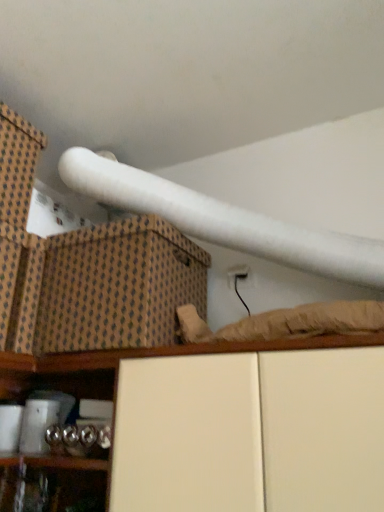
What do you see at coordinates (17, 165) in the screenshot? I see `brown woven box at upper left` at bounding box center [17, 165].

Identify the location of brown textured cardboard box at upper left. The width and height of the screenshot is (384, 512). (118, 286).

Is white matte cabinet at lower center not inside brown woven box at upper left?

white matte cabinet at lower center is positioned outside brown woven box at upper left.

Is there a large distance between white matte cabinet at lower center and brown woven box at upper left?

white matte cabinet at lower center is near brown woven box at upper left, not far away.

From a real-world perspective, is white matte cabinet at lower center above or below brown woven box at upper left?

white matte cabinet at lower center is below brown woven box at upper left.

Is white matte cabinet at lower center at the left side of brown woven box at upper left?

No.

From the image's perspective, does brown woven box at upper left appear higher than brown textured cardboard box at upper left?

Yes, from the image's perspective, brown woven box at upper left is above brown textured cardboard box at upper left.

Is brown woven box at upper left surrounding brown textured cardboard box at upper left?

No, brown textured cardboard box at upper left is not inside brown woven box at upper left.

Which of these two, brown woven box at upper left or brown textured cardboard box at upper left, stands taller?

brown textured cardboard box at upper left is taller.

Which of these two, brown textured cardboard box at upper left or white matte cabinet at lower center, is thinner?

white matte cabinet at lower center.

Image resolution: width=384 pixels, height=512 pixels. In order to click on shelf in front of the brown textured cardboard box at upper left in this screenshot , I will do `click(240, 426)`.

Considering the relative sizes of brown textured cardboard box at upper left and white matte cabinet at lower center in the image provided, is brown textured cardboard box at upper left bigger than white matte cabinet at lower center?

No, brown textured cardboard box at upper left is not bigger than white matte cabinet at lower center.

From the image's perspective, who appears lower, white matte cabinet at lower center or brown textured cardboard box at upper left?

white matte cabinet at lower center.

Is white matte cabinet at lower center wider or thinner than brown textured cardboard box at upper left?

Clearly, white matte cabinet at lower center has less width compared to brown textured cardboard box at upper left.

Does point (357, 371) appear closer or farther from the camera than point (86, 239)?

Clearly, point (357, 371) is closer to the camera than point (86, 239).

How far apart are white matte cabinet at lower center and brown textured cardboard box at upper left?

8.99 inches.

Between brown textured cardboard box at upper left and brown woven box at upper left, which one has smaller width?

brown woven box at upper left.

Where is `box behind the brown textured cardboard box at upper left`? box behind the brown textured cardboard box at upper left is located at coordinates (17, 165).

Considering the positions of points (152, 262) and (8, 150), is point (152, 262) farther from camera compared to point (8, 150)?

No, (152, 262) is closer to viewer.

Who is bigger, brown textured cardboard box at upper left or brown woven box at upper left?

brown textured cardboard box at upper left is bigger.

Can you confirm if brown woven box at upper left is shorter than white matte cabinet at lower center?

Yes.

From a real-world perspective, does brown woven box at upper left stand above white matte cabinet at lower center?

Yes, from a real-world perspective, brown woven box at upper left is on top of white matte cabinet at lower center.

Considering their positions, is brown woven box at upper left located in front of or behind white matte cabinet at lower center?

Visually, brown woven box at upper left is located behind white matte cabinet at lower center.

Between brown woven box at upper left and white matte cabinet at lower center, which one appears on the left side from the viewer's perspective?

brown woven box at upper left.

Locate an element on the screen. Image resolution: width=384 pixels, height=512 pixels. box above the white matte cabinet at lower center (from a real-world perspective) is located at coordinates (17, 165).

This screenshot has width=384, height=512. I want to click on cardboard box on the right of the brown woven box at upper left, so click(x=118, y=286).

Based on their spatial positions, is brown woven box at upper left or brown textured cardboard box at upper left further from white matte cabinet at lower center?

brown woven box at upper left.

From the image, which object appears to be nearer to brown woven box at upper left, brown textured cardboard box at upper left or white matte cabinet at lower center?

Among the two, brown textured cardboard box at upper left is located nearer to brown woven box at upper left.

Which object lies further to the anchor point brown woven box at upper left, white matte cabinet at lower center or brown textured cardboard box at upper left?

Among the two, white matte cabinet at lower center is located further to brown woven box at upper left.

Estimate the real-world distances between objects in this image. Which object is further from brown textured cardboard box at upper left, white matte cabinet at lower center or brown woven box at upper left?

The object further to brown textured cardboard box at upper left is brown woven box at upper left.

Which object lies nearer to the anchor point white matte cabinet at lower center, brown textured cardboard box at upper left or brown woven box at upper left?

brown textured cardboard box at upper left is closer to white matte cabinet at lower center.

Which object lies further to the anchor point brown textured cardboard box at upper left, brown woven box at upper left or white matte cabinet at lower center?

brown woven box at upper left lies further to brown textured cardboard box at upper left than the other object.

The height and width of the screenshot is (512, 384). Identify the location of cardboard box between brown woven box at upper left and white matte cabinet at lower center from top to bottom. (118, 286).